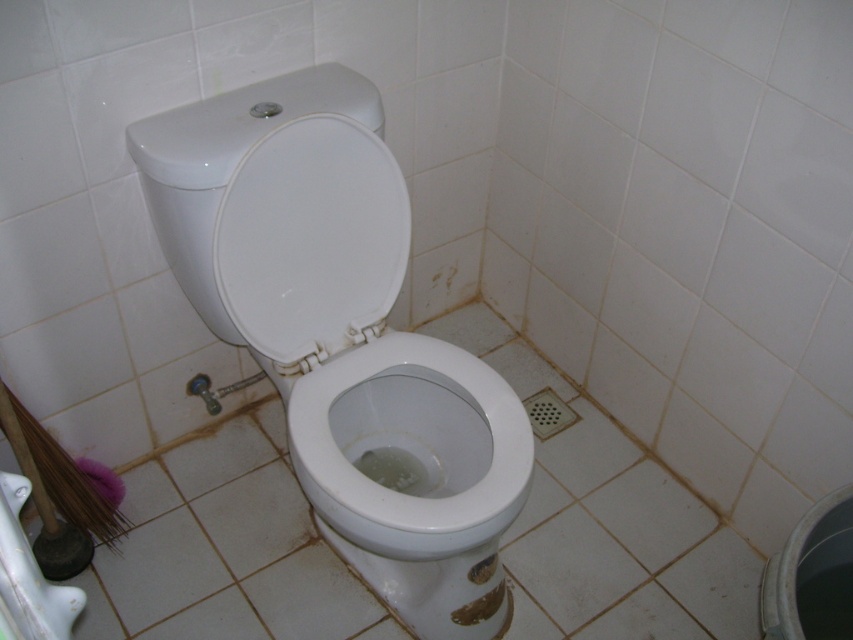
The height and width of the screenshot is (640, 853). Identify the location of white glossy toilet bowl at center. [425, 476].

Which of these two, white glossy toilet bowl at center or white glossy toilet lid at center, stands shorter?

Result: white glossy toilet lid at center

Does point (442, 388) come closer to viewer compared to point (358, 337)?

That is False.

The width and height of the screenshot is (853, 640). Find the location of `white glossy toilet bowl at center`. white glossy toilet bowl at center is located at coordinates (425, 476).

Is white glossy toilet at center closer to the viewer compared to white glossy toilet lid at center?

Yes, it is.

Which is behind, point (350, 412) or point (323, 346)?

Positioned behind is point (350, 412).

Is point (352, 100) positioned before point (276, 257)?

Yes.

Identify the location of white glossy toilet at center. The height and width of the screenshot is (640, 853). tap(343, 337).

Does white glossy toilet at center have a lesser height compared to white glossy toilet bowl at center?

No, white glossy toilet at center is not shorter than white glossy toilet bowl at center.

The height and width of the screenshot is (640, 853). I want to click on white glossy toilet at center, so click(343, 337).